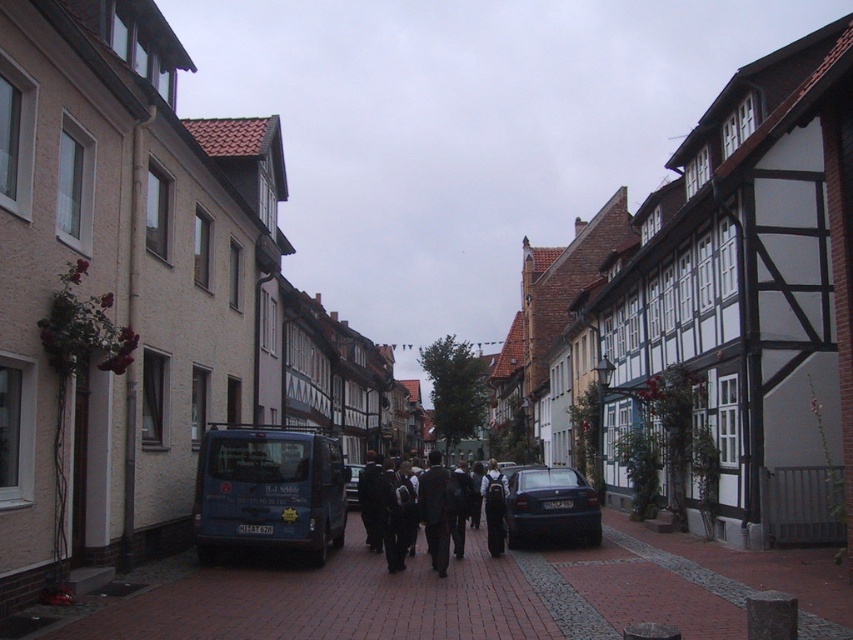
A child is standing on the brick pavement at center and wants to throw a ball to their sibling who is standing near the dark blue van parked near the building with a beige facade and small balcony. If the ball travels in a straight line, will it reach the sibling without hitting any obstacles?

The distance between the brick pavement at center and the dark blue van parked near the building with a beige facade and small balcony is 9.06 meters. Assuming there are no obstacles in the path, the ball could reach the sibling if thrown accurately over that distance.

You are a tourist standing on the brick pavement at center and want to take a photo of the blue metallic bus at center. Which direction should you move to get a clear view of the bus?

Since the brick pavement at center is to the right of the blue metallic bus at center, you should move to the left to get a clear view of the bus.

You are a delivery person with a 10 feet long cart. You need to move from the brick pavement at center to the blue metallic bus at center. Can your cart fit through the space between them?

The distance between the brick pavement at center and the blue metallic bus at center is 21.34 feet. Since your cart is 10 feet long, it can easily fit through the space between them as the distance is more than double the cart length.